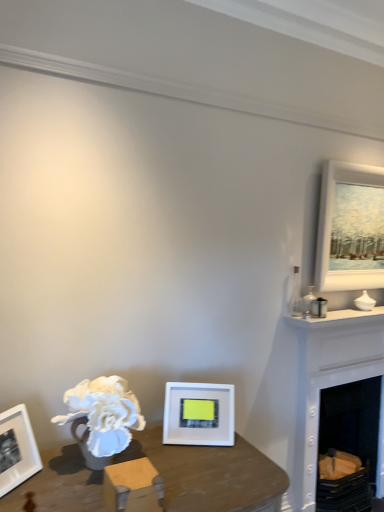
You are a GUI agent. You are given a task and a screenshot of the screen. Output one action in this format:
    pyautogui.click(x=<x>, y=<y>)
    Task: Click on the white matte picture frame at upper right, which ranks as the 1th picture frame in top-to-bottom order
    This screenshot has height=512, width=384.
    Given the screenshot: What is the action you would take?
    pyautogui.click(x=350, y=224)

Image resolution: width=384 pixels, height=512 pixels. Find the location of `white matte picture frame at lower center, the 2th picture frame viewed from the back`. white matte picture frame at lower center, the 2th picture frame viewed from the back is located at coordinates (199, 414).

From the image's perspective, is white matte picture frame at upper right, the second picture frame from the front, positioned above or below white matte picture frame at lower center, the 1th picture frame ordered from the bottom?

Clearly, from the image's perspective, white matte picture frame at upper right, the second picture frame from the front, is above white matte picture frame at lower center, the 1th picture frame ordered from the bottom.

What's the angular difference between white matte picture frame at upper right, which ranks as the 1th picture frame in top-to-bottom order, and white matte picture frame at lower center, placed as the first picture frame when sorted from front to back,'s facing directions?

There is a 26.6-degree angle between the facing directions of white matte picture frame at upper right, which ranks as the 1th picture frame in top-to-bottom order, and white matte picture frame at lower center, placed as the first picture frame when sorted from front to back.

Between point (361, 244) and point (208, 434), which one is positioned behind?

Point (361, 244)

Is white matte picture frame at upper right, which is the second picture frame from left to right, located outside white matte picture frame at lower center, marked as the second picture frame in a top-to-bottom arrangement?

That's correct, white matte picture frame at upper right, which is the second picture frame from left to right, is outside of white matte picture frame at lower center, marked as the second picture frame in a top-to-bottom arrangement.

From a real-world perspective, which object rests below the other?

From a 3D spatial view, white painted wood fireplace at right is below.

Considering the relative sizes of white painted wood fireplace at right and white matte picture frame at upper right, acting as the first picture frame starting from the back, in the image provided, is white painted wood fireplace at right thinner than white matte picture frame at upper right, acting as the first picture frame starting from the back,?

No, white painted wood fireplace at right is not thinner than white matte picture frame at upper right, acting as the first picture frame starting from the back.

Is white painted wood fireplace at right oriented towards white matte picture frame at upper right, the 2th picture frame when ordered from bottom to top?

No, white painted wood fireplace at right is not oriented towards white matte picture frame at upper right, the 2th picture frame when ordered from bottom to top.

Is white painted wood fireplace at right positioned beyond the bounds of white matte picture frame at upper right, the second picture frame from the front?

Yes, white painted wood fireplace at right is outside of white matte picture frame at upper right, the second picture frame from the front.

Which is in front, point (304, 401) or point (230, 403)?

The point (230, 403) is closer.

Considering the relative positions of white painted wood fireplace at right and white matte picture frame at lower center, placed as the 1th picture frame when sorted from left to right, in the image provided, is white painted wood fireplace at right to the right of white matte picture frame at lower center, placed as the 1th picture frame when sorted from left to right, from the viewer's perspective?

Yes, white painted wood fireplace at right is to the right of white matte picture frame at lower center, placed as the 1th picture frame when sorted from left to right.

From a real-world perspective, between white painted wood fireplace at right and white matte picture frame at lower center, the 2th picture frame viewed from the back, who is vertically higher?

white matte picture frame at lower center, the 2th picture frame viewed from the back.

Is point (328, 283) farther from viewer compared to point (339, 342)?

No, it is in front of (339, 342).

Can we say white matte picture frame at upper right, the 2th picture frame when ordered from bottom to top, lies outside white painted wood fireplace at right?

Yes, white matte picture frame at upper right, the 2th picture frame when ordered from bottom to top, is outside of white painted wood fireplace at right.

Relative to white painted wood fireplace at right, is white matte picture frame at upper right, the second picture frame from the front, in front or behind?

In the image, white matte picture frame at upper right, the second picture frame from the front, appears behind white painted wood fireplace at right.

From the image's perspective, count 2nd picture frames upward from the white painted wood fireplace at right and point to it. Please provide its 2D coordinates.

[(350, 224)]

From the image's perspective, is white matte picture frame at lower center, placed as the first picture frame when sorted from front to back, under white matte picture frame at upper right, the 2th picture frame when ordered from bottom to top?

Result: Yes.

Is the depth of white matte picture frame at lower center, marked as the second picture frame in a top-to-bottom arrangement, less than that of white matte picture frame at upper right, the first picture frame in the right-to-left sequence?

That is True.

Is white matte picture frame at lower center, the 1th picture frame ordered from the bottom, to the left or to the right of white matte picture frame at upper right, which ranks as the 1th picture frame in top-to-bottom order, in the image?

white matte picture frame at lower center, the 1th picture frame ordered from the bottom, is to the left of white matte picture frame at upper right, which ranks as the 1th picture frame in top-to-bottom order.

Is white matte picture frame at lower center, marked as the second picture frame in a top-to-bottom arrangement, bigger than white painted wood fireplace at right?

No, white matte picture frame at lower center, marked as the second picture frame in a top-to-bottom arrangement, is not bigger than white painted wood fireplace at right.

Considering the sizes of white matte picture frame at lower center, the 2th picture frame in the right-to-left sequence, and white painted wood fireplace at right in the image, is white matte picture frame at lower center, the 2th picture frame in the right-to-left sequence, taller or shorter than white painted wood fireplace at right?

Considering their sizes, white matte picture frame at lower center, the 2th picture frame in the right-to-left sequence, has less height than white painted wood fireplace at right.

Between point (201, 385) and point (318, 339), which one is positioned behind?

The point (318, 339) is farther.

Is white matte picture frame at lower center, placed as the first picture frame when sorted from front to back, to the left of white painted wood fireplace at right from the viewer's perspective?

Yes, white matte picture frame at lower center, placed as the first picture frame when sorted from front to back, is to the left of white painted wood fireplace at right.

Find the location of a particular element. The image size is (384, 512). picture frame located below the white matte picture frame at upper right, which ranks as the 1th picture frame in top-to-bottom order (from the image's perspective) is located at coordinates (199, 414).

Find the location of a particular element. picture frame to the right of white painted wood fireplace at right is located at coordinates pyautogui.click(x=350, y=224).

Based on their spatial positions, is white painted wood fireplace at right or white matte picture frame at upper right, which is the second picture frame from left to right, closer to white matte picture frame at lower center, placed as the 1th picture frame when sorted from left to right?

Based on the image, white painted wood fireplace at right appears to be nearer to white matte picture frame at lower center, placed as the 1th picture frame when sorted from left to right.

Looking at the image, which one is located further to white matte picture frame at lower center, placed as the first picture frame when sorted from front to back, white matte picture frame at upper right, the 2th picture frame when ordered from bottom to top, or white painted wood fireplace at right?

white matte picture frame at upper right, the 2th picture frame when ordered from bottom to top.

Estimate the real-world distances between objects in this image. Which object is further from white matte picture frame at upper right, the first picture frame in the right-to-left sequence, white matte picture frame at lower center, placed as the first picture frame when sorted from front to back, or white painted wood fireplace at right?

white matte picture frame at lower center, placed as the first picture frame when sorted from front to back, is positioned further to the anchor white matte picture frame at upper right, the first picture frame in the right-to-left sequence.

From the picture: Based on their spatial positions, is white matte picture frame at lower center, the 2th picture frame in the right-to-left sequence, or white matte picture frame at upper right, the first picture frame in the right-to-left sequence, further from white painted wood fireplace at right?

The object further to white painted wood fireplace at right is white matte picture frame at lower center, the 2th picture frame in the right-to-left sequence.

Considering their positions, is white painted wood fireplace at right positioned further to white matte picture frame at upper right, the first picture frame in the right-to-left sequence, than white matte picture frame at lower center, the 1th picture frame ordered from the bottom?

Based on the image, white matte picture frame at lower center, the 1th picture frame ordered from the bottom, appears to be further to white matte picture frame at upper right, the first picture frame in the right-to-left sequence.

Estimate the real-world distances between objects in this image. Which object is closer to white painted wood fireplace at right, white matte picture frame at upper right, which ranks as the 1th picture frame in top-to-bottom order, or white matte picture frame at lower center, placed as the first picture frame when sorted from front to back?

Based on the image, white matte picture frame at upper right, which ranks as the 1th picture frame in top-to-bottom order, appears to be nearer to white painted wood fireplace at right.

The width and height of the screenshot is (384, 512). I want to click on picture frame between white matte picture frame at upper right, the second picture frame from the front, and white painted wood fireplace at right, in the vertical direction, so click(x=199, y=414).